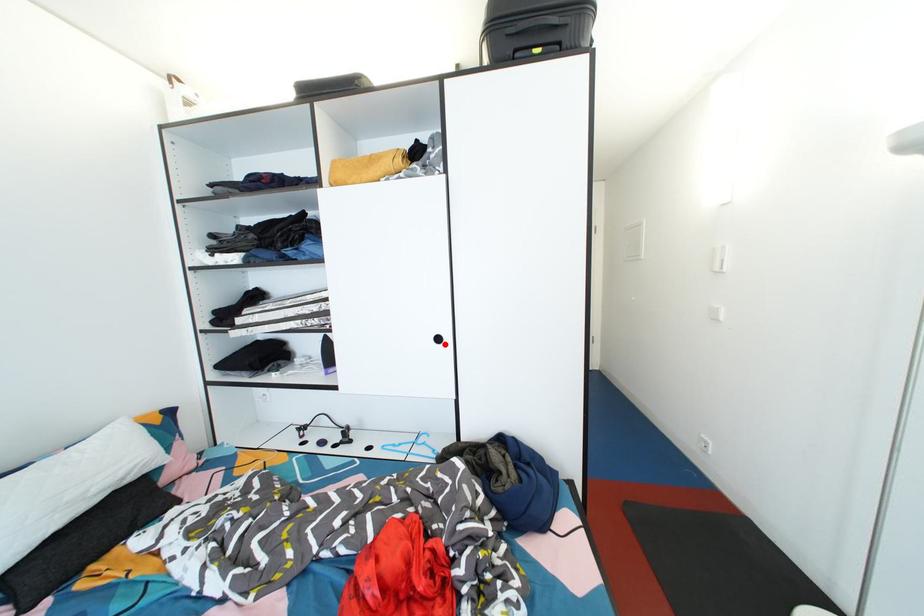
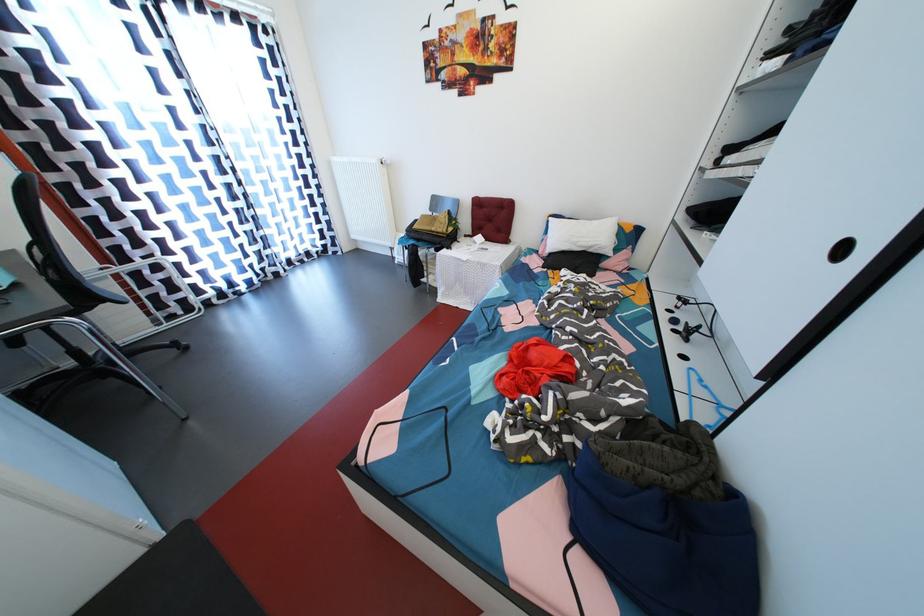
Question: I am providing you with two images of the same scene from different viewpoints. A red point is shown in image1. For the corresponding object point in image2, is it positioned nearer or farther from the camera?

Choices:
 (A) Nearer
 (B) Farther

Answer: (B)